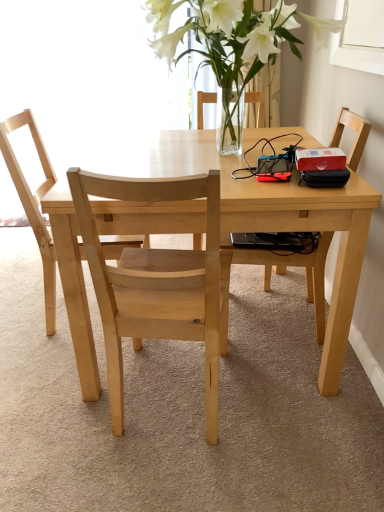
Question: Considering the positions of clear glass vase at upper center and light wood table at center in the image, is clear glass vase at upper center bigger or smaller than light wood table at center?

Choices:
 (A) small
 (B) big

Answer: (A)

Question: Considering the positions of clear glass vase at upper center and light wood table at center in the image, is clear glass vase at upper center taller or shorter than light wood table at center?

Choices:
 (A) short
 (B) tall

Answer: (A)

Question: Estimate the real-world distances between objects in this image. Which object is closer to the light wood table at center?

Choices:
 (A) light brown wooden chair at right, which ranks as the first chair in right-to-left order
 (B) natural wood chair at center, which is the second chair from left to right
 (C) natural wood chair at center, the 3th chair from the right
 (D) clear glass vase at upper center

Answer: (B)

Question: Which of these objects is positioned farthest from the light brown wooden chair at right, the third chair when ordered from left to right?

Choices:
 (A) clear glass vase at upper center
 (B) natural wood chair at center, which is the second chair from left to right
 (C) natural wood chair at center, the 3th chair from the right
 (D) light wood table at center

Answer: (C)